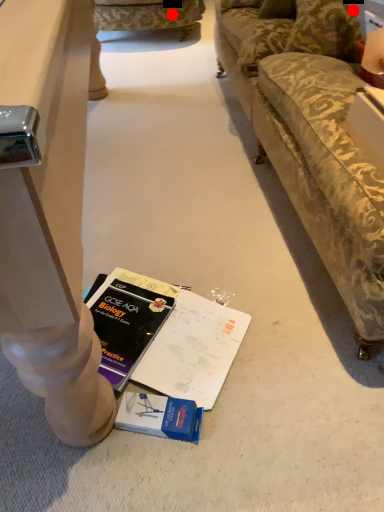
Question: Two points are circled on the image, labeled by A and B beside each circle. Which of the following is the closest to the observer?

Choices:
 (A) A is closer
 (B) B is closer

Answer: (B)